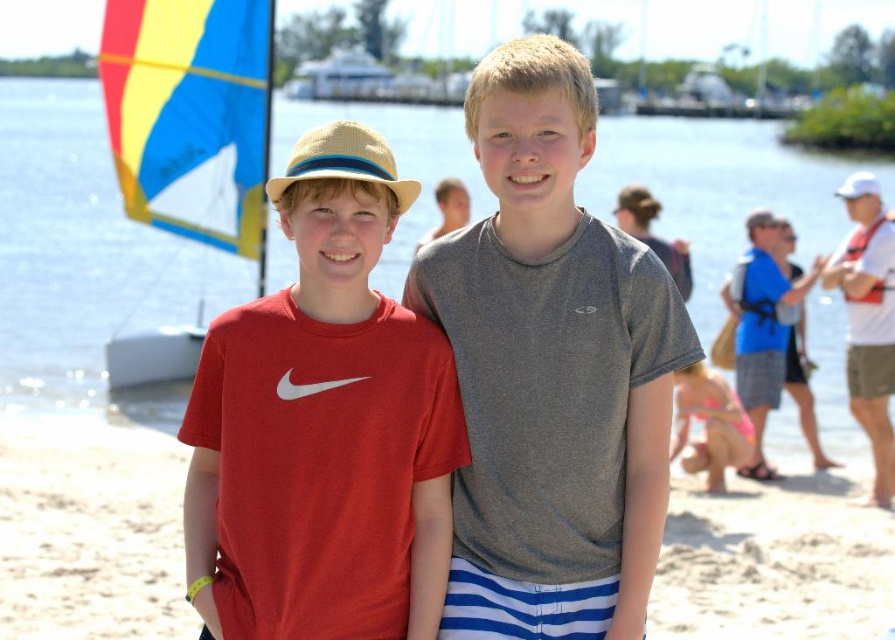
Question: Is gray heathered t-shirt at center above matte red t-shirt at center?

Choices:
 (A) yes
 (B) no

Answer: (A)

Question: Based on their relative distances, which object is farther from the transparent water at center?

Choices:
 (A) gray heathered t-shirt at center
 (B) white sandy beach at center

Answer: (A)

Question: Does matte red t-shirt at center come behind white sandy beach at center?

Choices:
 (A) yes
 (B) no

Answer: (B)

Question: Where is matte red t-shirt at center located in relation to white sandy beach at center in the image?

Choices:
 (A) below
 (B) above

Answer: (B)

Question: Considering the real-world distances, which object is farthest from the matte red t-shirt at center?

Choices:
 (A) transparent water at center
 (B) gray heathered t-shirt at center
 (C) white sandy beach at center

Answer: (A)

Question: Which point is closer to the camera taking this photo?

Choices:
 (A) (633, 602)
 (B) (859, 608)
 (C) (43, 248)

Answer: (A)